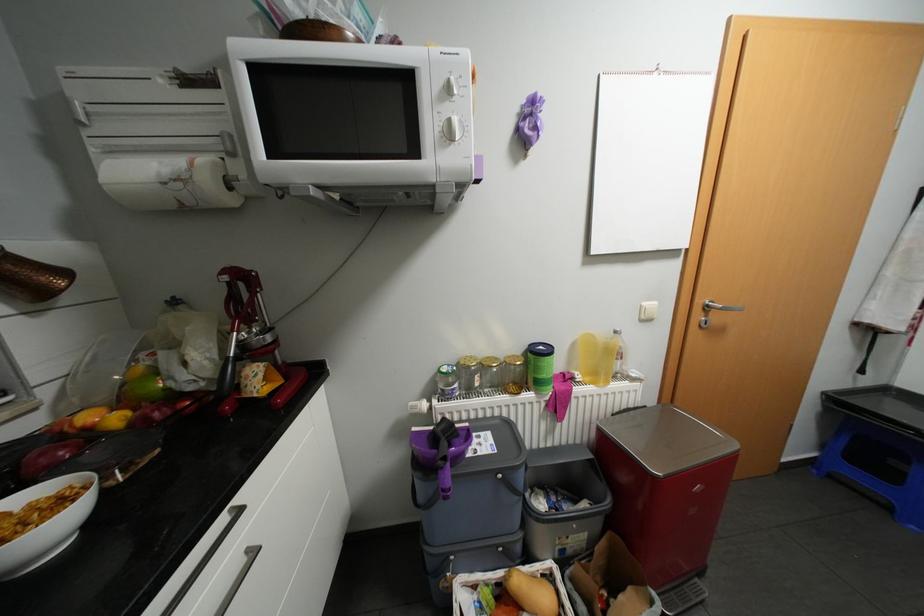
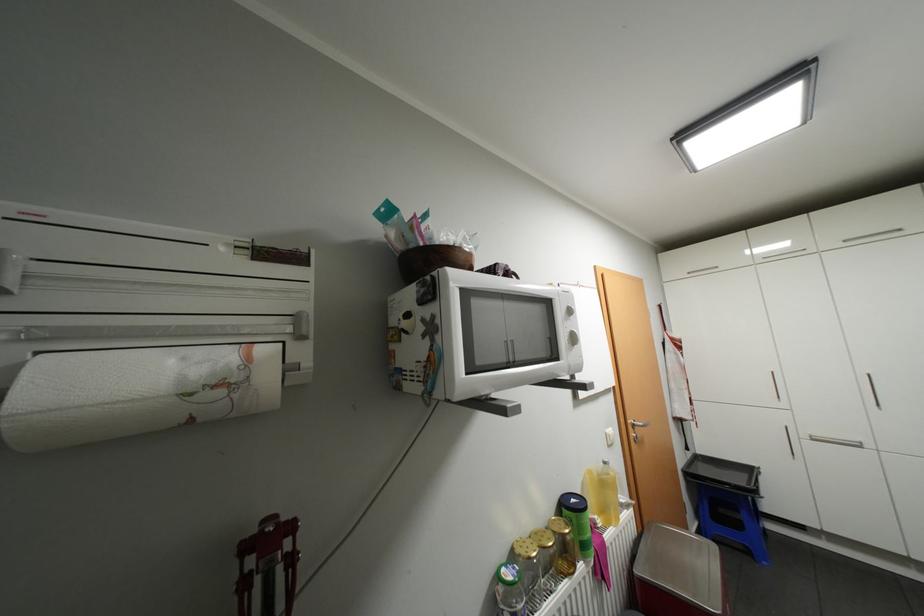
The point at (90, 123) is marked in the first image. Where is the corresponding point in the second image?

(6, 291)